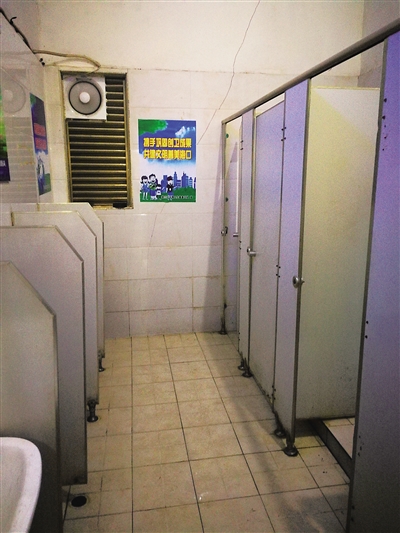
Image resolution: width=400 pixels, height=533 pixels. What are the coordinates of `door` in the screenshot? It's located at (268, 240), (232, 237).